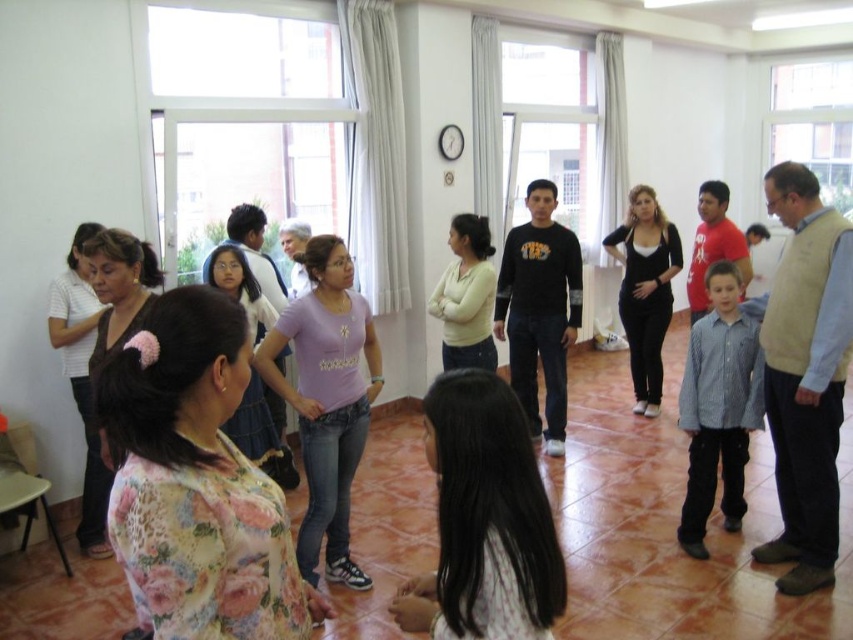
Question: Does light brown hair at center appear under blue striped shirt at lower right?

Choices:
 (A) yes
 (B) no

Answer: (A)

Question: Which of these objects is positioned farthest from the beige sweater vest at right?

Choices:
 (A) blue striped shirt at lower right
 (B) floral-patterned blouse at lower left
 (C) light brown hair at center

Answer: (C)

Question: Is light brown hair at center below beige sweater vest at right?

Choices:
 (A) yes
 (B) no

Answer: (A)

Question: Which of the following is the farthest from the observer?

Choices:
 (A) (827, 307)
 (B) (718, 358)
 (C) (482, 557)

Answer: (B)

Question: Is the position of light brown hair at center more distant than that of blue striped shirt at lower right?

Choices:
 (A) no
 (B) yes

Answer: (A)

Question: Estimate the real-world distances between objects in this image. Which object is closer to the blue striped shirt at lower right?

Choices:
 (A) light brown hair at center
 (B) floral-patterned blouse at lower left

Answer: (B)